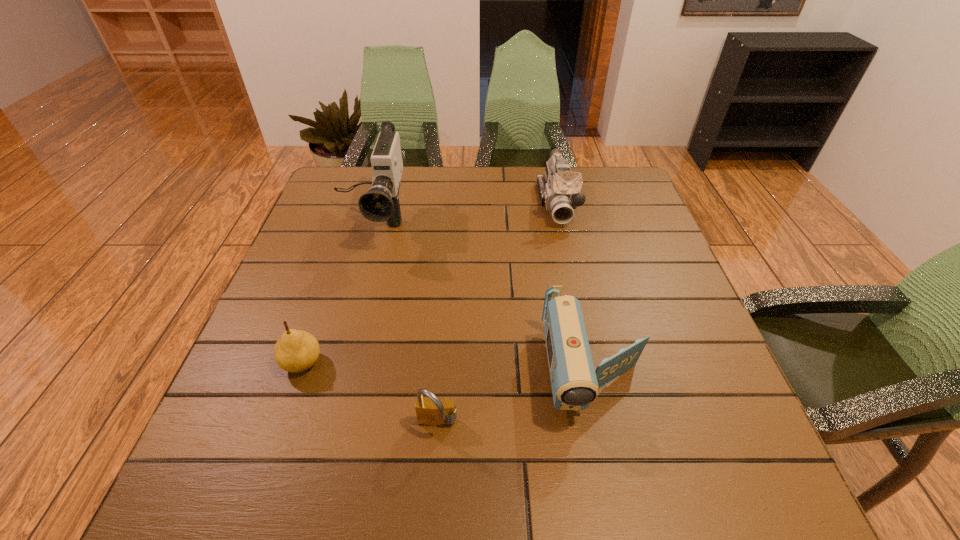
You are a GUI agent. You are given a task and a screenshot of the screen. Output one action in this format:
    pyautogui.click(x=<x>, y=<y>)
    Task: Click on the tallest camcorder
    
    Given the screenshot: What is the action you would take?
    pyautogui.click(x=381, y=203)

In order to click on the tallest object in this screenshot , I will do `click(381, 203)`.

Image resolution: width=960 pixels, height=540 pixels. Find the location of `the shortest camcorder`. the shortest camcorder is located at coordinates (575, 383).

You are a GUI agent. You are given a task and a screenshot of the screen. Output one action in this format:
    pyautogui.click(x=<x>, y=<y>)
    Task: Click on the pear
    This screenshot has width=960, height=540.
    Given the screenshot: What is the action you would take?
    pyautogui.click(x=296, y=351)

I want to click on the third object from left to right, so click(431, 412).

This screenshot has height=540, width=960. Find the location of `free space located on the recording direction of the tallest object`. free space located on the recording direction of the tallest object is located at coordinates (329, 360).

I want to click on vacant space located on the side of the nearest camcorder with the flip-out screen, so click(x=621, y=498).

Identify the location of free space located on the back of the pear. (339, 256).

Locate an element on the screen. vacant space situated on the side with the combination dials of the padlock is located at coordinates (434, 473).

At what (x,y) coordinates should I click in order to perform the action: click on camcorder situated at the left edge. Please return your answer as a coordinate pair (x, y). The width and height of the screenshot is (960, 540). Looking at the image, I should click on (381, 203).